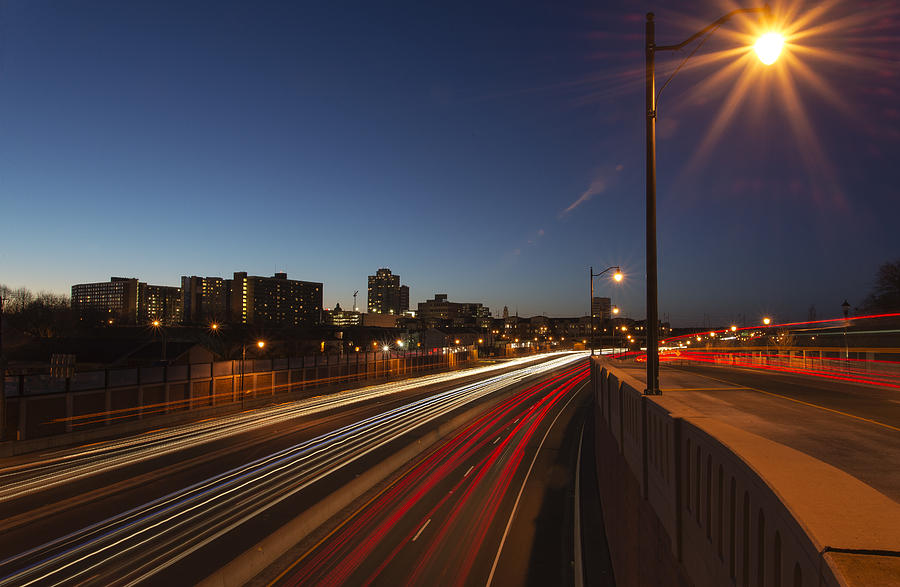
At what (x,y) coordinates should I click in order to perform the action: click on small orange lights. Please return your answer as a coordinate pair (x, y). This screenshot has width=900, height=587. Looking at the image, I should click on (258, 342), (214, 329), (158, 323).